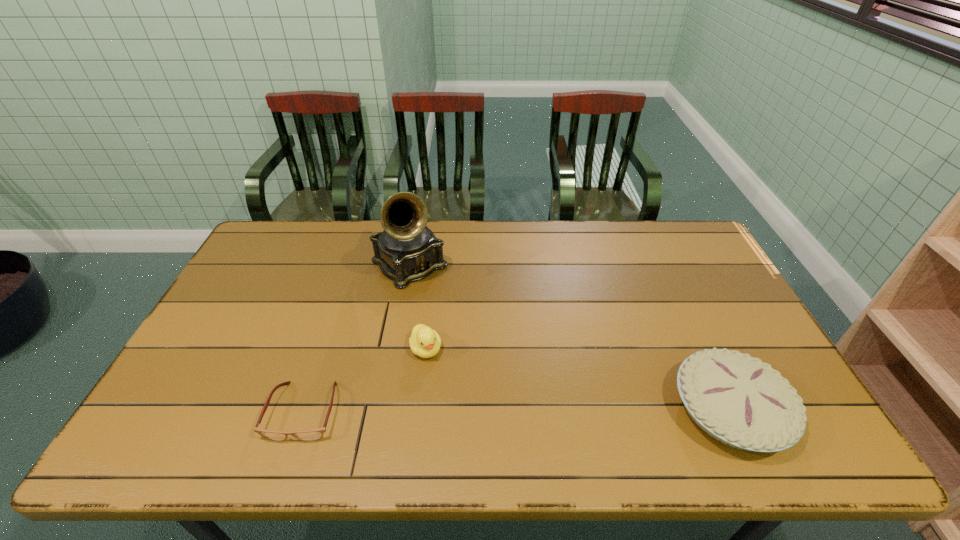
Locate an element on the screen. The height and width of the screenshot is (540, 960). free space on the desktop that is between the spectacles and the rightmost object and is positioned on the horn of the phonograph record is located at coordinates (556, 410).

The width and height of the screenshot is (960, 540). In order to click on vacant space on the desktop that is between the shortest object and the pie and is positioned on the beak of the duckling in this screenshot , I will do `click(456, 410)`.